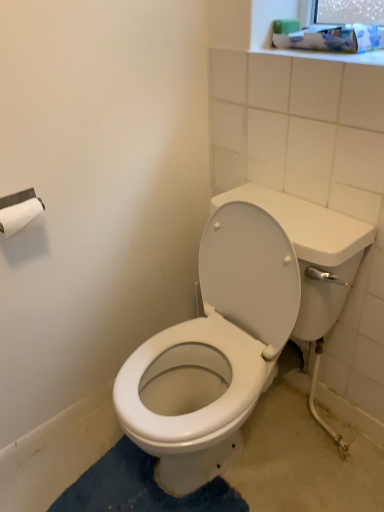
The width and height of the screenshot is (384, 512). What are the coordinates of `blue carpet at lower left` in the screenshot? It's located at (140, 488).

Measure the distance between blue carpet at lower left and camera.

The distance of blue carpet at lower left from camera is 1.28 meters.

The image size is (384, 512). Describe the element at coordinates (140, 488) in the screenshot. I see `blue carpet at lower left` at that location.

Locate an element on the screen. This screenshot has height=512, width=384. blue carpet at lower left is located at coordinates (140, 488).